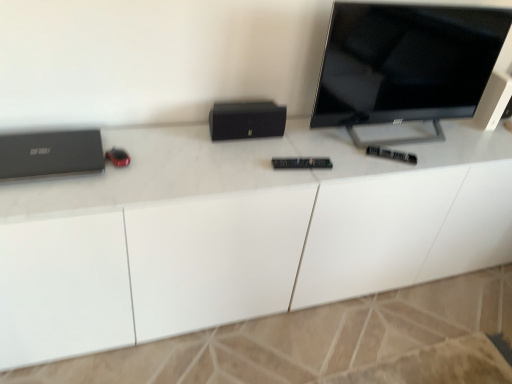
You are a GUI agent. You are given a task and a screenshot of the screen. Output one action in this format:
    pyautogui.click(x=<x>, y=<y>)
    Task: Click on the free space between matte black laptop at left and black plastic remote at center
    
    Given the screenshot: What is the action you would take?
    pyautogui.click(x=228, y=163)